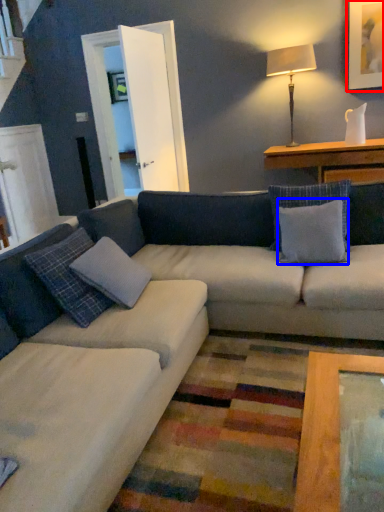
Question: Which of the following is the closest to the observer, picture frame (highlighted by a red box) or pillow (highlighted by a blue box)?

Choices:
 (A) picture frame
 (B) pillow

Answer: (B)